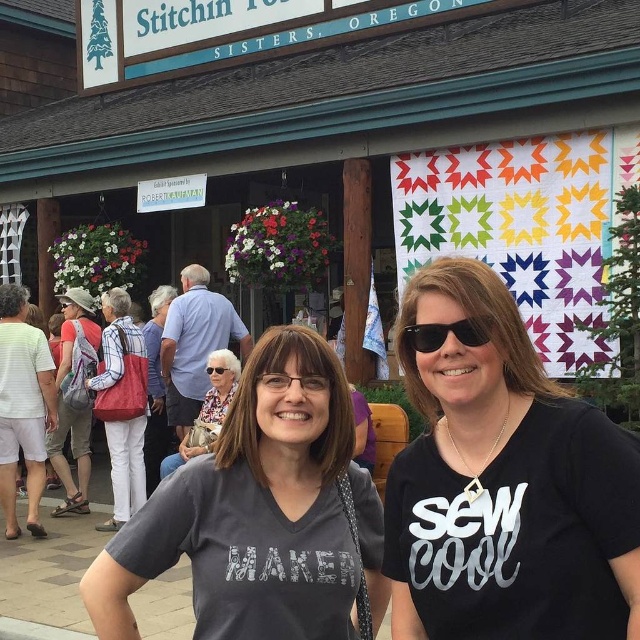
Does matte black shirt at center come behind clear plastic glasses at center?

Yes, matte black shirt at center is further from the viewer.

Does matte black shirt at center have a greater height compared to clear plastic glasses at center?

Correct, matte black shirt at center is much taller as clear plastic glasses at center.

Measure the distance between matte black shirt at center and camera.

31.71 feet

You are a GUI agent. You are given a task and a screenshot of the screen. Output one action in this format:
    pyautogui.click(x=<x>, y=<y>)
    Task: Click on the matte black shirt at center
    This screenshot has width=640, height=640.
    Given the screenshot: What is the action you would take?
    pyautogui.click(x=156, y=387)

Between black matte t-shirt at center and matte red bag at center, which one has less height?

black matte t-shirt at center

Who is positioned more to the right, black matte t-shirt at center or matte red bag at center?

Positioned to the right is black matte t-shirt at center.

Find the location of `black matte t-shirt at center`. black matte t-shirt at center is located at coordinates (504, 484).

At what (x,y) coordinates should I click in order to perform the action: click on black matte t-shirt at center. Please return your answer as a coordinate pair (x, y). The width and height of the screenshot is (640, 640). Looking at the image, I should click on (504, 484).

Can you confirm if floral fabric shirt at center is wider than transparent plastic goggles at center?

Indeed, floral fabric shirt at center has a greater width compared to transparent plastic goggles at center.

Can you confirm if floral fabric shirt at center is smaller than transparent plastic goggles at center?

No, floral fabric shirt at center is not smaller than transparent plastic goggles at center.

Measure the distance between floral fabric shirt at center and camera.

8.19 meters

At what (x,y) coordinates should I click in order to perform the action: click on floral fabric shirt at center. Please return your answer as a coordinate pair (x, y). The width and height of the screenshot is (640, 640). Looking at the image, I should click on pos(205,412).